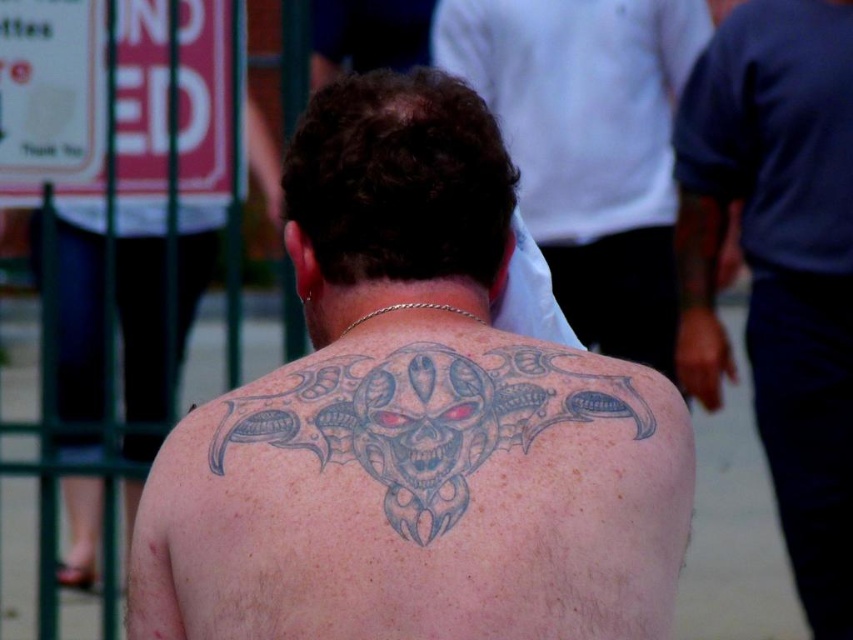
Consider the image. Does gray tattooed skin at center appear over gray tattooed back at center?

Incorrect, gray tattooed skin at center is not positioned above gray tattooed back at center.

Is point (259, 534) in front of point (589, 58)?

Yes.

Is point (495, 438) farther from camera compared to point (561, 168)?

No, it is not.

Locate an element on the screen. gray tattooed skin at center is located at coordinates (415, 422).

Between dark blue shirt at right and gray tattooed back at center, which one is positioned higher?

Positioned higher is gray tattooed back at center.

Does dark blue shirt at right have a greater width compared to gray tattooed back at center?

Incorrect, dark blue shirt at right's width does not surpass gray tattooed back at center's.

What do you see at coordinates (779, 264) in the screenshot? The image size is (853, 640). I see `dark blue shirt at right` at bounding box center [779, 264].

Find the location of a particular element. Image resolution: width=853 pixels, height=640 pixels. dark blue shirt at right is located at coordinates (779, 264).

Who is higher up, dark blue shirt at right or gray/black tattoo at upper center?

dark blue shirt at right is higher up.

Who is more forward, (798,356) or (424,380)?

Point (424,380) is in front.

The width and height of the screenshot is (853, 640). In order to click on dark blue shirt at right in this screenshot , I will do `click(779, 264)`.